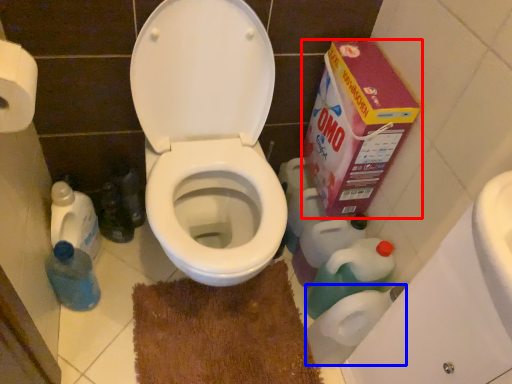
Question: Among these objects, which one is nearest to the camera, cardboard box (highlighted by a red box) or toilet paper (highlighted by a blue box)?

Choices:
 (A) cardboard box
 (B) toilet paper

Answer: (A)